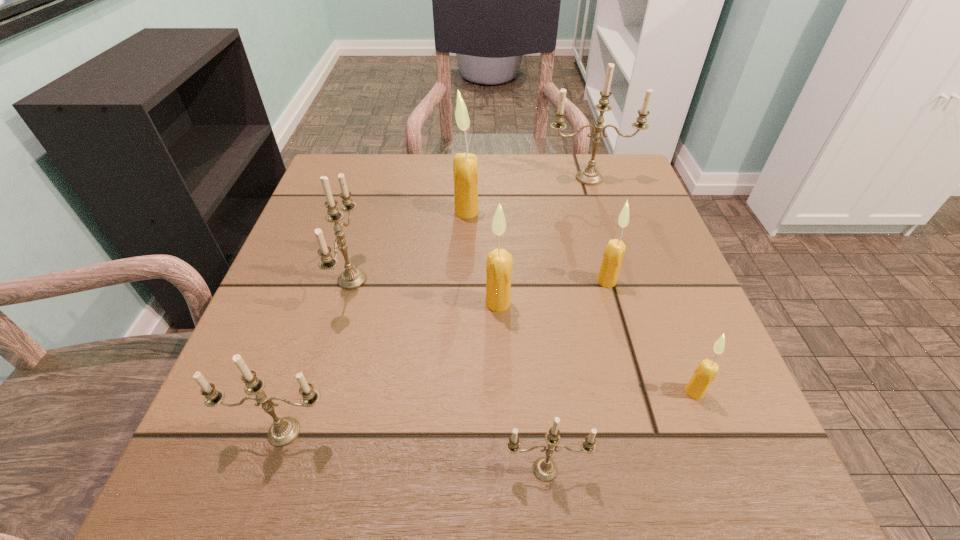
Where is `vacant region located 0.050m on the front of the third biggest metallic candle`? The image size is (960, 540). vacant region located 0.050m on the front of the third biggest metallic candle is located at coordinates (267, 485).

You are a GUI agent. You are given a task and a screenshot of the screen. Output one action in this format:
    pyautogui.click(x=<x>, y=<y>)
    Task: Click on the free space located on the back of the rightmost cream candle
    
    Given the screenshot: What is the action you would take?
    pyautogui.click(x=658, y=297)

Identify the location of vacant area situated on the back of the third metallic candle from left to right. The height and width of the screenshot is (540, 960). (540, 422).

Find the location of a particular element. object that is at the near left corner is located at coordinates (283, 431).

Locate an element on the screen. object present at the far right corner is located at coordinates (590, 176).

This screenshot has width=960, height=540. I want to click on free space at the far edge of the desktop, so click(484, 159).

You are a GUI agent. You are given a task and a screenshot of the screen. Output one action in this format:
    pyautogui.click(x=<x>, y=<y>)
    Task: Click on the vacant area at the near edge of the desktop
    
    Given the screenshot: What is the action you would take?
    pyautogui.click(x=564, y=467)

In the image, there is a desktop. Identify the location of vacant space at the left edge. The image size is (960, 540). (315, 360).

This screenshot has height=540, width=960. I want to click on vacant space at the right edge of the desktop, so click(669, 378).

Identify the location of free region at the near left corner. This screenshot has width=960, height=540. (194, 472).